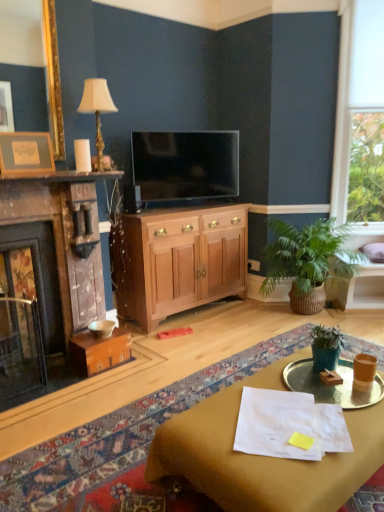
What is the approximate width of wooden picture frame at upper left?

It is 2.17 inches.

Locate an element on the screen. The image size is (384, 512). green woven basket at right, the 1th houseplant positioned from the back is located at coordinates (307, 261).

What do you see at coordinates (97, 109) in the screenshot? I see `gold textured lamp at upper center` at bounding box center [97, 109].

You are a GUI agent. You are given a task and a screenshot of the screen. Output one action in this format:
    pyautogui.click(x=<x>, y=<y>)
    Task: Click on the transparent glass window at upper right
    The image size is (384, 512).
    Given the screenshot: What is the action you would take?
    pyautogui.click(x=360, y=118)

Identify the location of purple fabric pillow at upper right. (374, 252).

From the image's perspective, who appears lower, black plastic phone at center or matte brown desk at lower right?

matte brown desk at lower right, from the image's perspective.

Could matte brown desk at lower right be considered to be inside black plastic phone at center?

No, matte brown desk at lower right is located outside of black plastic phone at center.

From a real-world perspective, who is located higher, black plastic phone at center or matte brown desk at lower right?

black plastic phone at center is physically above.

I want to click on corded phone above the matte brown desk at lower right (from a real-world perspective), so click(x=132, y=199).

This screenshot has height=512, width=384. In order to click on houseplant that is the 2nd object located in front of the wooden cabinet at center in this screenshot , I will do `click(326, 347)`.

From a real-world perspective, which object rests below the other?

From a 3D spatial view, green matte plant pot at center, which is counted as the 2th houseplant, starting from the back, is below.

Does green matte plant pot at center, which is counted as the 2th houseplant, starting from the back, have a larger size compared to wooden cabinet at center?

No, green matte plant pot at center, which is counted as the 2th houseplant, starting from the back, is not bigger than wooden cabinet at center.

Between green matte plant pot at center, which is the first houseplant in front-to-back order, and wooden cabinet at center, which one has more height?

wooden cabinet at center.

Which of these two, gold textured lamp at upper center or transparent glass window at upper right, stands shorter?

With less height is gold textured lamp at upper center.

Consider the image. From the image's perspective, between gold textured lamp at upper center and transparent glass window at upper right, who is located below?

gold textured lamp at upper center.

From a real-world perspective, which object rests below the other?

gold textured lamp at upper center is physically lower.

Is gold textured lamp at upper center smaller than transparent glass window at upper right?

Correct, gold textured lamp at upper center occupies less space than transparent glass window at upper right.

Which object is positioned more to the right, green matte plant pot at center, which is counted as the 2th houseplant, starting from the back, or matte black tv at center?

green matte plant pot at center, which is counted as the 2th houseplant, starting from the back, is more to the right.

Is green matte plant pot at center, which is counted as the 2th houseplant, starting from the back, positioned far away from matte black tv at center?

green matte plant pot at center, which is counted as the 2th houseplant, starting from the back, is far away from matte black tv at center.

Considering the points (321, 342) and (191, 189), which point is behind, point (321, 342) or point (191, 189)?

The point (191, 189) is more distant.

From the image's perspective, is green matte plant pot at center, which is counted as the 2th houseplant, starting from the back, above matte black tv at center?

No, from the image's perspective, green matte plant pot at center, which is counted as the 2th houseplant, starting from the back, is not on top of matte black tv at center.

From the image's perspective, which one is positioned higher, transparent glass window at upper right or black plastic phone at center?

transparent glass window at upper right, from the image's perspective.

What are the coordinates of `window that appears above the black plastic phone at center (from a real-world perspective)` in the screenshot? It's located at (360, 118).

From their relative heights in the image, would you say transparent glass window at upper right is taller or shorter than black plastic phone at center?

Clearly, transparent glass window at upper right is taller compared to black plastic phone at center.

Can you see gold textured lamp at upper center touching matte wood mantle at upper center?

gold textured lamp at upper center and matte wood mantle at upper center are not in contact.

Is gold textured lamp at upper center located outside matte wood mantle at upper center?

gold textured lamp at upper center lies outside matte wood mantle at upper center's area.

Is gold textured lamp at upper center closer to the viewer compared to matte wood mantle at upper center?

No, gold textured lamp at upper center is further to the viewer.

How much distance is there between wooden picture frame at upper left and translucent glass tray at center?

wooden picture frame at upper left is 1.96 meters away from translucent glass tray at center.

Is translucent glass tray at center located within wooden picture frame at upper left?

No, translucent glass tray at center is not a part of wooden picture frame at upper left.

Could you tell me if wooden picture frame at upper left is turned towards translucent glass tray at center?

No.

Which point is more distant from viewer, (50,163) or (374,386)?

The point (50,163) is more distant.

Locate an element on the screen. corded phone above the matte brown desk at lower right (from a real-world perspective) is located at coordinates (132, 199).

Find the location of a particular element. cabinetry that is on the left side of green matte plant pot at center, which is counted as the 2th houseplant, starting from the back is located at coordinates (181, 261).

Based on their spatial positions, is transparent glass window at upper right or green matte plant pot at center, which is counted as the 2th houseplant, starting from the back, closer to gold textured lamp at upper center?

Based on the image, green matte plant pot at center, which is counted as the 2th houseplant, starting from the back, appears to be nearer to gold textured lamp at upper center.

Estimate the real-world distances between objects in this image. Which object is closer to wooden cabinet at center, wooden picture frame at upper left or translucent glass tray at center?

The object closer to wooden cabinet at center is wooden picture frame at upper left.

Looking at this image, from the image, which object appears to be farther from matte brown desk at lower right, gold textured lamp at upper center or wooden fireplace at left?

Based on the image, gold textured lamp at upper center appears to be further to matte brown desk at lower right.

Looking at the image, which one is located further to purple fabric pillow at upper right, matte brown desk at lower right or gold textured lamp at upper center?

Among the two, matte brown desk at lower right is located further to purple fabric pillow at upper right.

Based on their spatial positions, is purple fabric pillow at upper right or wooden picture frame at upper left further from green woven basket at right, the 1th houseplant positioned from the back?

Based on the image, wooden picture frame at upper left appears to be further to green woven basket at right, the 1th houseplant positioned from the back.

Considering their positions, is wooden fireplace at left positioned further to matte brown desk at lower right than translucent glass tray at center?

wooden fireplace at left is further to matte brown desk at lower right.

From the image, which object appears to be farther from matte wood mantle at upper center, wooden fireplace at left or gold textured lamp at upper center?

wooden fireplace at left is positioned further to the anchor matte wood mantle at upper center.

Based on their spatial positions, is black plastic phone at center or wooden cabinet at center further from matte brown desk at lower right?

Among the two, black plastic phone at center is located further to matte brown desk at lower right.

Where is `cabinetry between matte wood mantle at upper center and black plastic phone at center along the z-axis`? cabinetry between matte wood mantle at upper center and black plastic phone at center along the z-axis is located at coordinates (181, 261).

This screenshot has height=512, width=384. I want to click on cabinetry that lies between gold textured lamp at upper center and translucent glass tray at center from top to bottom, so click(181, 261).

Image resolution: width=384 pixels, height=512 pixels. I want to click on lamp positioned between matte brown desk at lower right and matte black tv at center from near to far, so click(x=97, y=109).

In order to click on desk between wooden fireplace at left and transparent glass window at upper right in this screenshot , I will do point(261,456).